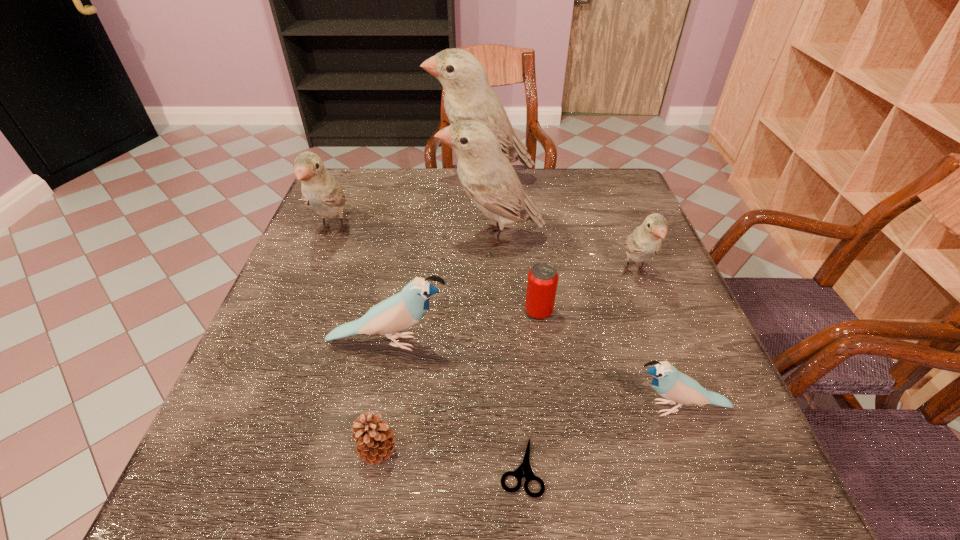
The width and height of the screenshot is (960, 540). Identify the location of object that is the seventh closest one to the tallest bird. (375, 441).

This screenshot has height=540, width=960. What are the coordinates of `bird that can be found as the fifth closest to the shortest bird` in the screenshot? It's located at (320, 190).

Find the location of a particular element. This screenshot has width=960, height=540. bird that is the second closest to the tallest object is located at coordinates (320, 190).

This screenshot has height=540, width=960. In order to click on the second closest white bird to the tallest bird in this screenshot , I will do `click(320, 190)`.

Image resolution: width=960 pixels, height=540 pixels. Identify the location of the third closest white bird to the shears. (320, 190).

You are a GUI agent. You are given a task and a screenshot of the screen. Output one action in this format:
    pyautogui.click(x=<x>, y=<y>)
    Task: Click on the free region that satisfies the following two spatial constraints: 1. at the face of the pinecone; 2. on the left side of the bigger blue bird
    
    Given the screenshot: What is the action you would take?
    pyautogui.click(x=368, y=449)

Locate an element on the screen. vacant space that satisfies the following two spatial constraints: 1. at the face of the fifth shortest bird; 2. on the back side of the shears is located at coordinates (500, 466).

At what (x,y) coordinates should I click in order to perform the action: click on free space that satisfies the following two spatial constraints: 1. at the face of the can; 2. on the right side of the leftmost bird. Please return your answer as a coordinate pair (x, y). The width and height of the screenshot is (960, 540). Looking at the image, I should click on (302, 312).

Locate an element on the screen. The height and width of the screenshot is (540, 960). free space in the image that satisfies the following two spatial constraints: 1. on the front side of the seventh tallest object; 2. at the face of the farther blue bird is located at coordinates (542, 342).

The image size is (960, 540). What are the coordinates of `vacant space that satisfies the following two spatial constraints: 1. at the face of the can; 2. on the right side of the biggest white bird` in the screenshot? It's located at (482, 312).